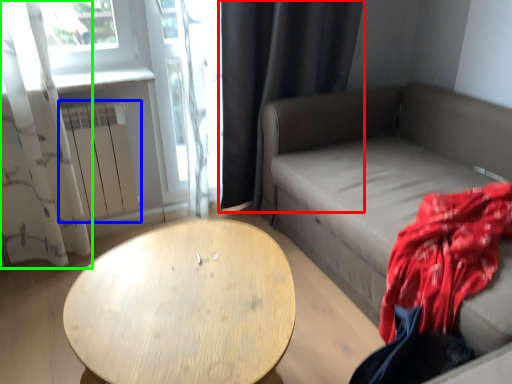
Question: Which object is positioned farthest from curtain (highlighted by a red box)? Select from radiator (highlighted by a blue box) and curtain (highlighted by a green box).

Choices:
 (A) radiator
 (B) curtain

Answer: (B)